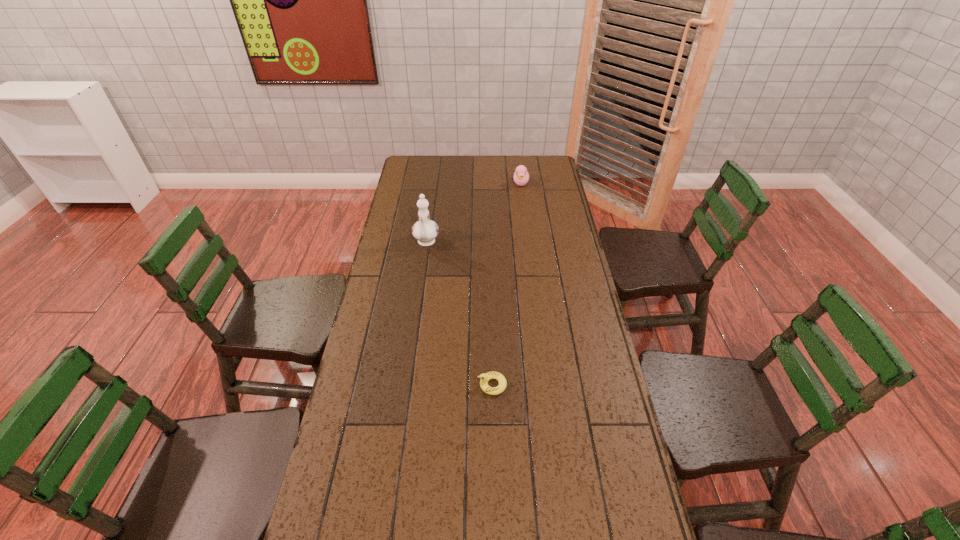
At what (x,y) coordinates should I click in order to perform the action: click on empty space that is in between the right duckling and the chinaware. Please return your answer as a coordinate pair (x, y). Looking at the image, I should click on (473, 213).

The height and width of the screenshot is (540, 960). I want to click on vacant region between the tallest object and the second object from left to right, so click(x=459, y=314).

This screenshot has height=540, width=960. I want to click on free space between the farthest object and the second farthest object, so click(x=473, y=213).

Identify the location of vacant space that's between the chinaware and the farther duckling. [473, 213].

Locate an element on the screen. The height and width of the screenshot is (540, 960). free space between the second object from left to right and the right duckling is located at coordinates (507, 284).

Where is `empty space that is in between the rightmost object and the shorter duckling`? Image resolution: width=960 pixels, height=540 pixels. empty space that is in between the rightmost object and the shorter duckling is located at coordinates (507, 284).

You are a GUI agent. You are given a task and a screenshot of the screen. Output one action in this format:
    pyautogui.click(x=<x>, y=<y>)
    Task: Click on the empty location between the taller duckling and the nearer duckling
    
    Given the screenshot: What is the action you would take?
    pyautogui.click(x=507, y=284)

Locate an element on the screen. blank region between the chinaware and the farther duckling is located at coordinates (473, 213).

Where is `blank region between the tallest object and the rightmost object`? blank region between the tallest object and the rightmost object is located at coordinates (473, 213).

Locate which object ranks in proximity to the right duckling. Please provide its 2D coordinates. Your answer should be formatted as a tuple, i.e. [(x, y)], where the tuple contains the x and y coordinates of a point satisfying the conditions above.

[(425, 230)]